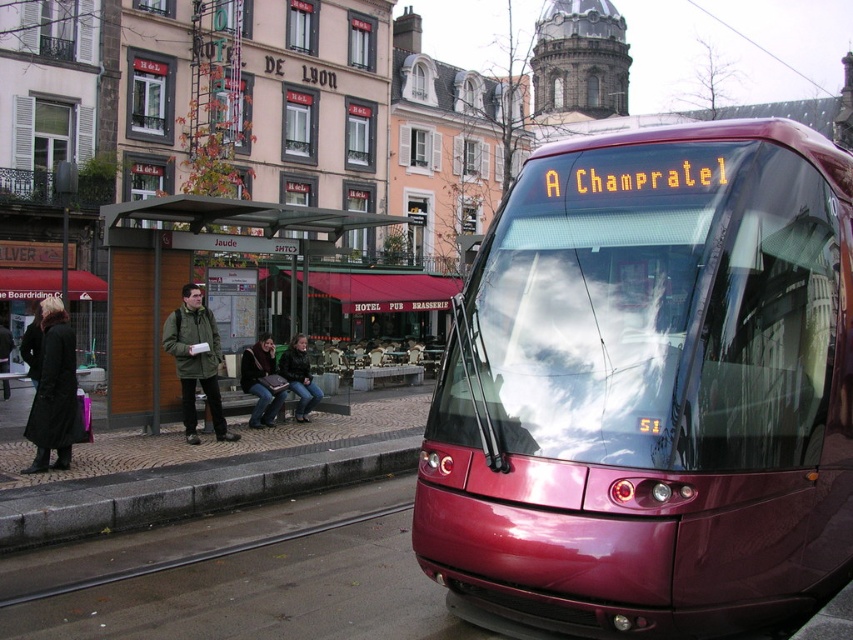
Is point (564, 269) positioned before point (265, 388)?

Yes, it is in front of point (265, 388).

Is point (451, 468) closer to camera compared to point (254, 376)?

Yes.

At what (x,y) coordinates should I click in order to perform the action: click on shiny maroon tram at center. Please return your answer as a coordinate pair (x, y). This screenshot has height=640, width=853. Looking at the image, I should click on (648, 390).

Who is positioned more to the right, black leather coat at left or dark brown leather jacket at center?

From the viewer's perspective, dark brown leather jacket at center appears more on the right side.

Is black leather coat at left above dark brown leather jacket at center?

Indeed, black leather coat at left is positioned over dark brown leather jacket at center.

The height and width of the screenshot is (640, 853). I want to click on black leather coat at left, so click(x=53, y=390).

Which is more to the left, shiny maroon tram at center or black leather coat at left?

Positioned to the left is black leather coat at left.

The width and height of the screenshot is (853, 640). What do you see at coordinates (648, 390) in the screenshot? I see `shiny maroon tram at center` at bounding box center [648, 390].

This screenshot has width=853, height=640. What are the coordinates of `shiny maroon tram at center` in the screenshot? It's located at (648, 390).